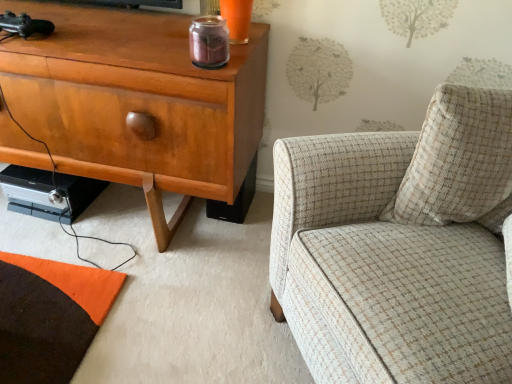
Question: From the image's perspective, does matte wood cabinet at left appear lower than plaid fabric armchair at right?

Choices:
 (A) yes
 (B) no

Answer: (B)

Question: Does matte wood cabinet at left have a larger size compared to plaid fabric armchair at right?

Choices:
 (A) no
 (B) yes

Answer: (A)

Question: Is plaid fabric armchair at right completely or partially inside matte wood cabinet at left?

Choices:
 (A) yes
 (B) no

Answer: (B)

Question: Is matte wood cabinet at left taller than plaid fabric armchair at right?

Choices:
 (A) yes
 (B) no

Answer: (B)

Question: Is matte wood cabinet at left wider than plaid fabric armchair at right?

Choices:
 (A) yes
 (B) no

Answer: (B)

Question: Does matte wood cabinet at left touch plaid fabric armchair at right?

Choices:
 (A) no
 (B) yes

Answer: (A)

Question: Can we say matte wood cabinet at left lies outside beige textured pillow at right?

Choices:
 (A) no
 (B) yes

Answer: (B)

Question: Is matte wood cabinet at left thinner than beige textured pillow at right?

Choices:
 (A) yes
 (B) no

Answer: (B)

Question: From the image's perspective, does matte wood cabinet at left appear lower than beige textured pillow at right?

Choices:
 (A) no
 (B) yes

Answer: (A)

Question: From the image's perspective, is matte wood cabinet at left located above beige textured pillow at right?

Choices:
 (A) no
 (B) yes

Answer: (B)

Question: Considering the relative positions of matte wood cabinet at left and beige textured pillow at right in the image provided, is matte wood cabinet at left behind beige textured pillow at right?

Choices:
 (A) no
 (B) yes

Answer: (B)

Question: Can you confirm if matte wood cabinet at left is shorter than beige textured pillow at right?

Choices:
 (A) yes
 (B) no

Answer: (B)

Question: Is beige textured pillow at right to the left of plaid fabric armchair at right from the viewer's perspective?

Choices:
 (A) no
 (B) yes

Answer: (B)